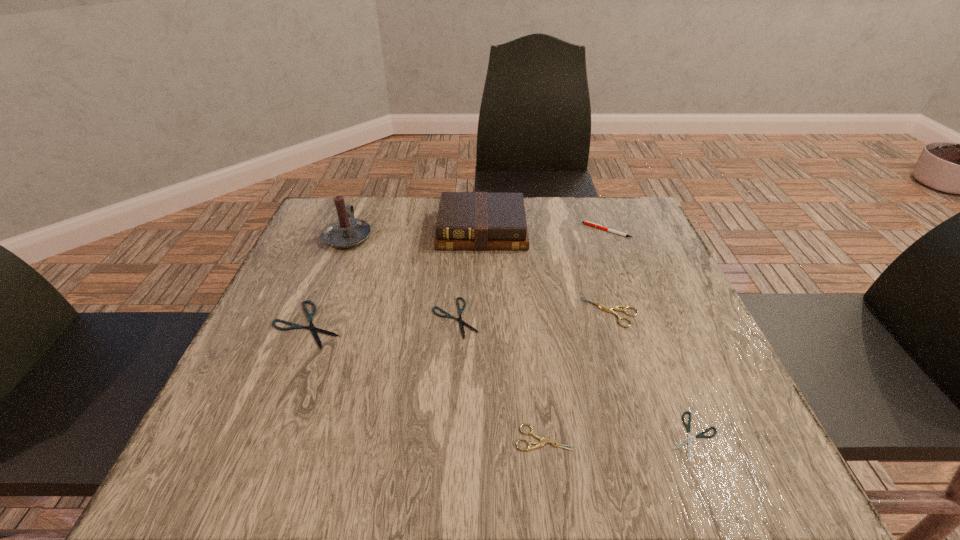
Identify which object is located as the seventh nearest to the second tallest object. Please provide its 2D coordinates. Your answer should be formatted as a tuple, i.e. [(x, y)], where the tuple contains the x and y coordinates of a point satisfying the conditions above.

[(700, 435)]

Identify the location of shears that can be found as the closest to the second tallest object. The height and width of the screenshot is (540, 960). (461, 322).

Where is `the fourth closest shears relative to the second smallest black shears`? The image size is (960, 540). the fourth closest shears relative to the second smallest black shears is located at coordinates (700, 435).

Where is `the second closest black shears to the second smallest black shears`? the second closest black shears to the second smallest black shears is located at coordinates (700, 435).

Identify which black shears is located as the third nearest to the fifth shortest object. Please provide its 2D coordinates. Your answer should be formatted as a tuple, i.e. [(x, y)], where the tuple contains the x and y coordinates of a point satisfying the conditions above.

[(311, 327)]

Find the location of a particular element. This screenshot has height=540, width=960. free space that satisfies the following two spatial constraints: 1. on the clicker of the sixth shortest object; 2. on the left side of the rightmost black shears is located at coordinates (684, 435).

This screenshot has width=960, height=540. Identify the location of vacant area that satisfies the following two spatial constraints: 1. on the spine side of the Bible; 2. on the left side of the bigger beige shears. (482, 312).